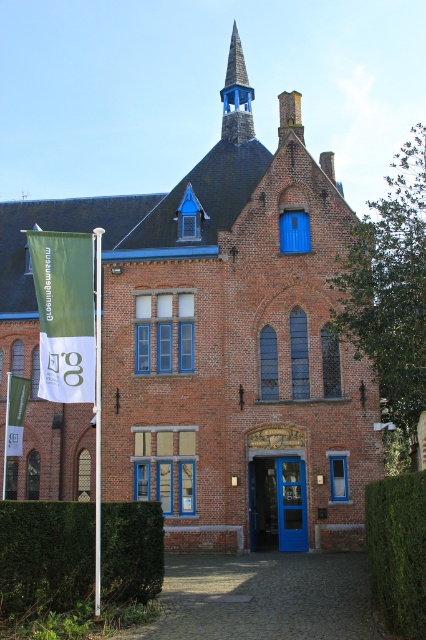
Is the position of blue glass door at center more distant than that of green fabric flag at left?

No, it is not.

Which is in front, point (279, 500) or point (17, 417)?

Point (279, 500) is more forward.

The image size is (426, 640). Identify the location of blue glass door at center. (278, 502).

Is point (106, 595) farther from camera compared to point (385, 579)?

Yes, point (106, 595) is farther from viewer.

Is green leafy hedge at lower left above green leafy hedge at lower right?

No, green leafy hedge at lower left is not above green leafy hedge at lower right.

Who is more distant from viewer, (x=149, y=513) or (x=406, y=620)?

Positioned behind is point (x=149, y=513).

Where is `green leafy hedge at lower left`? Image resolution: width=426 pixels, height=640 pixels. green leafy hedge at lower left is located at coordinates (45, 554).

Does green fabric banner at left have a greater height compared to green fabric flag at left?

Yes.

Find the location of `green fabric banner at left`. green fabric banner at left is located at coordinates (65, 314).